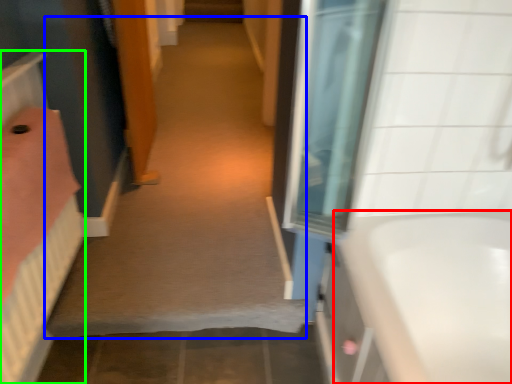
Question: Considering the real-world distances, which object is closest to bathtub (highlighted by a red box)? plain (highlighted by a blue box) or bed (highlighted by a green box).

Choices:
 (A) plain
 (B) bed

Answer: (A)